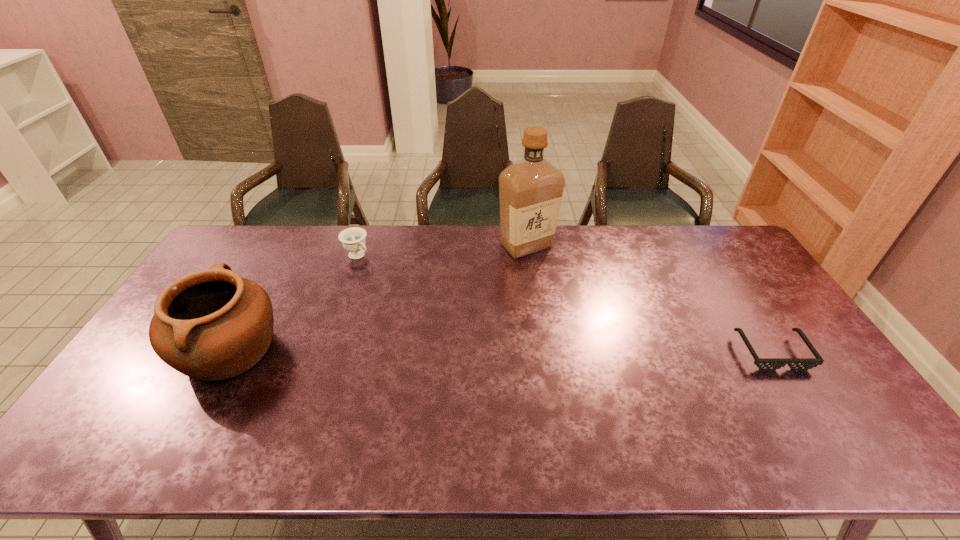
I want to click on object present at the right edge, so click(x=764, y=364).

Locate an element on the screen. This screenshot has width=960, height=540. object positioned at the near left corner is located at coordinates (212, 324).

In the image, there is a desktop. At what (x,y) coordinates should I click in order to perform the action: click on vacant space at the far edge. Please return your answer as a coordinate pair (x, y). The image size is (960, 540). Looking at the image, I should click on click(622, 232).

Find the location of `vacant space at the near edge of the desktop`. vacant space at the near edge of the desktop is located at coordinates (226, 397).

Find the location of a particular element. This screenshot has width=960, height=540. free space at the right edge of the desktop is located at coordinates (732, 289).

Find the location of `free space at the near right corner`. free space at the near right corner is located at coordinates (803, 390).

The width and height of the screenshot is (960, 540). I want to click on vacant area between the liquor and the rightmost object, so click(x=649, y=299).

This screenshot has width=960, height=540. In order to click on free point between the shortest object and the leftmost object in this screenshot , I will do `click(501, 351)`.

Find the location of a particular element. The width and height of the screenshot is (960, 540). free point between the third object from right to left and the pottery is located at coordinates (294, 303).

This screenshot has width=960, height=540. I want to click on free spot between the tallest object and the shortest object, so [649, 299].